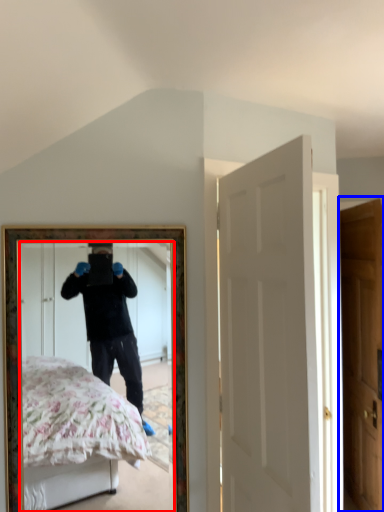
Question: Which object appears closest to the camera in this image, mirror (highlighted by a red box) or door (highlighted by a blue box)?

Choices:
 (A) mirror
 (B) door

Answer: (A)